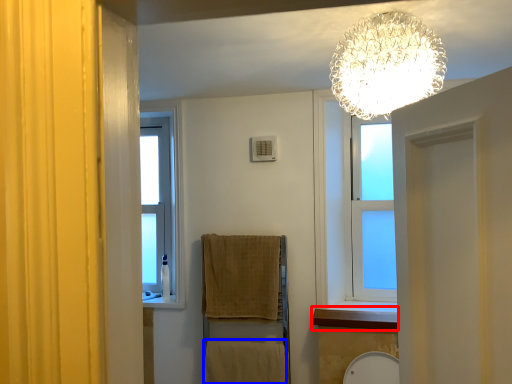
Question: Which object is closer to the camera taking this photo, window sill (highlighted by a red box) or bath towel (highlighted by a blue box)?

Choices:
 (A) window sill
 (B) bath towel

Answer: (A)